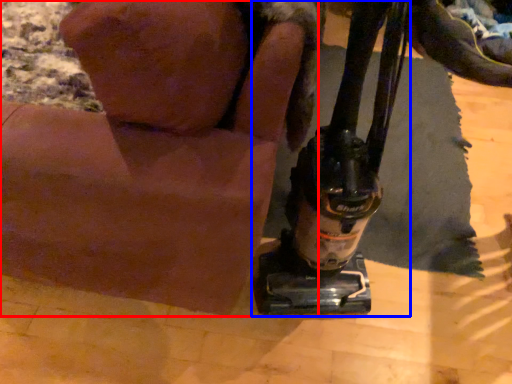
Question: Which object appears farthest to the camera in this image, animal (highlighted by a red box) or sewing machine (highlighted by a blue box)?

Choices:
 (A) animal
 (B) sewing machine

Answer: (B)